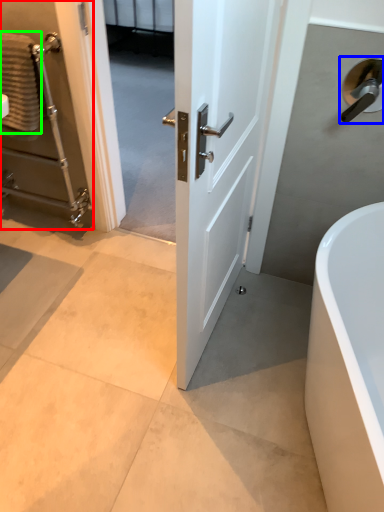
Question: Based on their relative distances, which object is farther from elevator (highlighted by a red box)? Choose from door handle (highlighted by a blue box) and material (highlighted by a green box).

Choices:
 (A) door handle
 (B) material

Answer: (A)